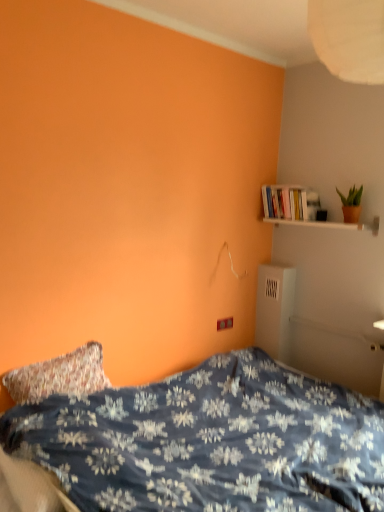
Question: Do you think blue floral fabric bed at lower left is within white wooden shelf at upper right, or outside of it?

Choices:
 (A) outside
 (B) inside

Answer: (A)

Question: Looking at the image, does blue floral fabric bed at lower left seem bigger or smaller compared to white wooden shelf at upper right?

Choices:
 (A) big
 (B) small

Answer: (A)

Question: Estimate the real-world distances between objects in this image. Which object is farther from the white wooden shelf at upper right?

Choices:
 (A) white glossy bookshelf at upper right
 (B) green matte plant at upper right
 (C) blue floral fabric bed at lower left

Answer: (C)

Question: Estimate the real-world distances between objects in this image. Which object is closer to the white wooden shelf at upper right?

Choices:
 (A) white glossy bookshelf at upper right
 (B) blue floral fabric bed at lower left
 (C) green matte plant at upper right

Answer: (A)